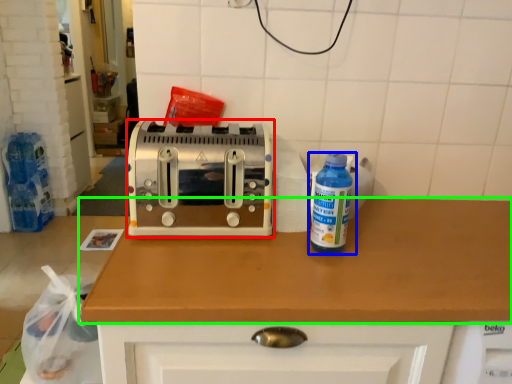
Question: Considering the real-world distances, which object is closest to toaster (highlighted by a red box)? bottle (highlighted by a blue box) or countertop (highlighted by a green box).

Choices:
 (A) bottle
 (B) countertop

Answer: (B)